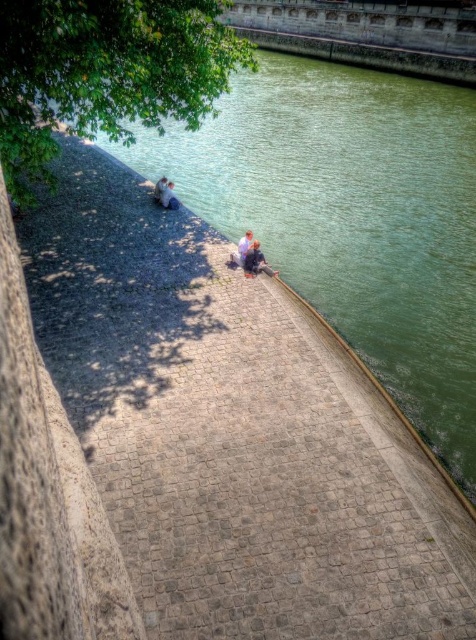
Question: Considering the real-world distances, which object is closest to the smooth skin couple at center?

Choices:
 (A) green leafy tree at upper left
 (B) green water at lower left

Answer: (A)

Question: Which object appears farthest from the camera in this image?

Choices:
 (A) smooth skin couple at center
 (B) green water at lower left
 (C) blue denim jacket at center

Answer: (A)

Question: Can you confirm if blue denim jacket at center is positioned to the left of smooth skin couple at center?

Choices:
 (A) yes
 (B) no

Answer: (B)

Question: Estimate the real-world distances between objects in this image. Which object is farther from the green leafy tree at upper left?

Choices:
 (A) green water at lower left
 (B) blue denim jacket at center
 (C) smooth skin couple at center

Answer: (A)

Question: Is green water at lower left wider than green leafy tree at upper left?

Choices:
 (A) no
 (B) yes

Answer: (B)

Question: Is green leafy tree at upper left below blue denim jacket at center?

Choices:
 (A) yes
 (B) no

Answer: (B)